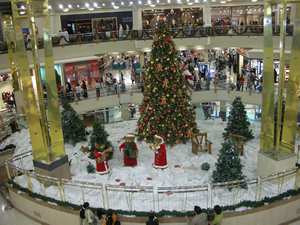
What are the coordinates of `floor` in the screenshot? It's located at (13, 216), (298, 221), (129, 85), (91, 93), (3, 117), (222, 87).